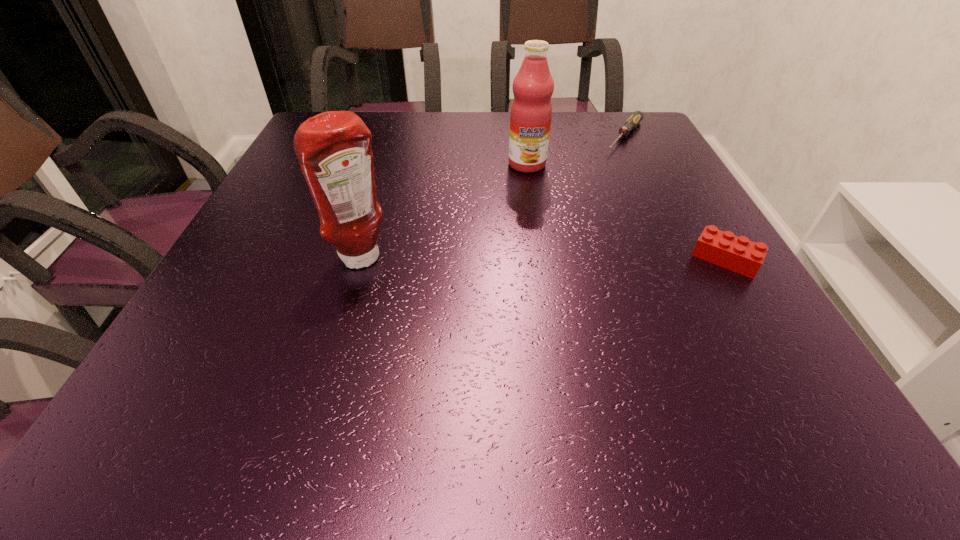
The width and height of the screenshot is (960, 540). In the image, there is a desktop. Find the location of `vacant space at the right edge`. vacant space at the right edge is located at coordinates (725, 279).

Locate an element on the screen. free space at the near left corner is located at coordinates (238, 331).

This screenshot has height=540, width=960. I want to click on vacant area at the near right corner of the desktop, so click(749, 332).

This screenshot has height=540, width=960. What are the coordinates of `empty location between the third tallest object and the leftmost object` in the screenshot? It's located at (544, 259).

This screenshot has width=960, height=540. What are the coordinates of `free space between the second shortest object and the condiment` in the screenshot? It's located at (544, 259).

The image size is (960, 540). In order to click on empty space between the farthest object and the second shortest object in this screenshot , I will do `click(676, 198)`.

You are a GUI agent. You are given a task and a screenshot of the screen. Output one action in this format:
    pyautogui.click(x=<x>, y=<y>)
    Task: Click on the vacant point located between the farthest object and the Lego
    The height and width of the screenshot is (540, 960).
    Given the screenshot: What is the action you would take?
    pyautogui.click(x=676, y=198)

Find the location of a particular element. This screenshot has width=960, height=540. empty space that is in between the Lego and the fruit juice is located at coordinates (626, 212).

Locate an element on the screen. vacant area between the second shortest object and the condiment is located at coordinates (544, 259).

Locate an element on the screen. The image size is (960, 540). vacant area that lies between the condiment and the fruit juice is located at coordinates (445, 212).